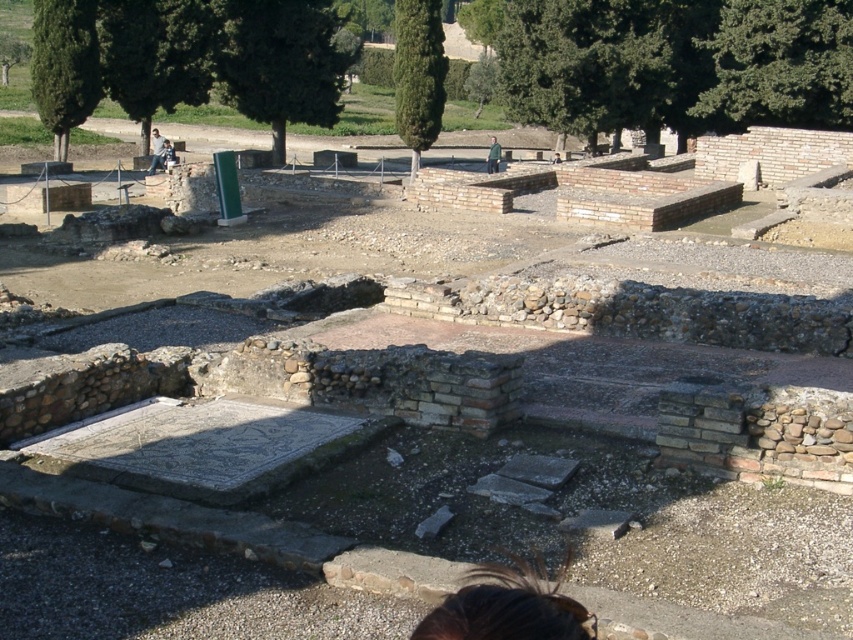
You are a photographer standing at the archaeological site. You want to capture a closeup shot of the brown hair at lower center. The camera you are using has a minimum focusing distance of 2 meters. Can you take the photo without moving closer?

The brown hair at lower center is 2.59 meters away from the camera. Since the minimum focusing distance is 2 meters, the camera can focus on the brown hair at lower center from this distance, so yes, you can take the closeup shot without moving closer.

You are an archaeologist examining the site and notice two jackets left by previous researchers. The denim jacket at center and the green fabric jacket at center. Which jacket is closer to you?

The denim jacket at center is closer to you as it is positioned in front of the green fabric jacket at center.